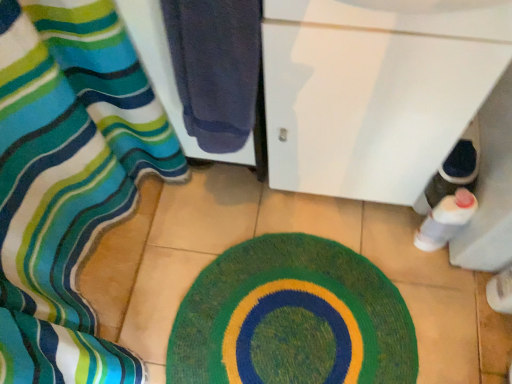
Locate an element on the screen. vacant space behind green knitted bath mat at center is located at coordinates (266, 212).